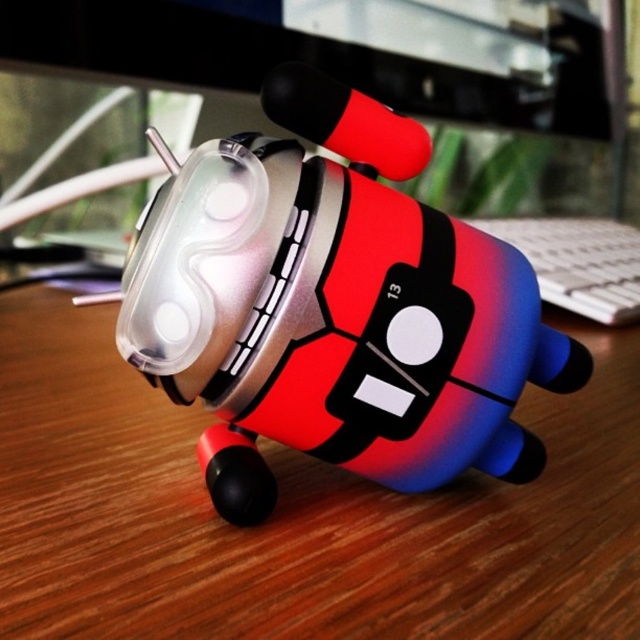
You are organizing a desk and want to place a new item between the wooden desk at center and the gradient plastic toy at center. The item you want to place is 30 centimeters long. Will there be enough space between them to fit the item?

The wooden desk at center and gradient plastic toy at center are 28.53 centimeters apart. Since the item is 30 centimeters long, it will not fit between them as the space is smaller than the item.

You are a delivery drone that needs to place a package on the wooden desk at center. However, there is a gradient plastic toy at center in the way. Can you lower the package to the desk without hitting the toy?

The wooden desk at center is located below gradient plastic toy at center, so yes, the package can be lowered between the gradient plastic toy at center and the desk.